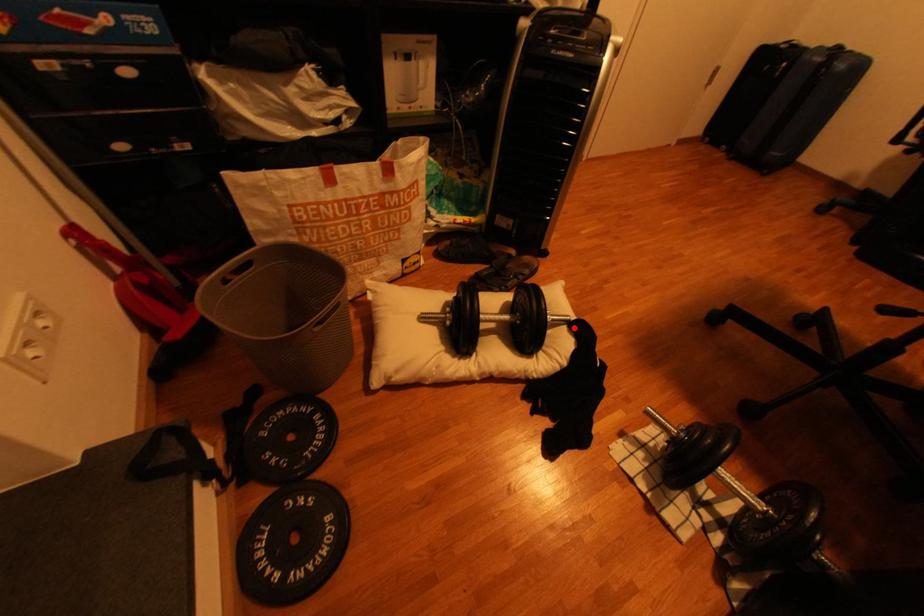
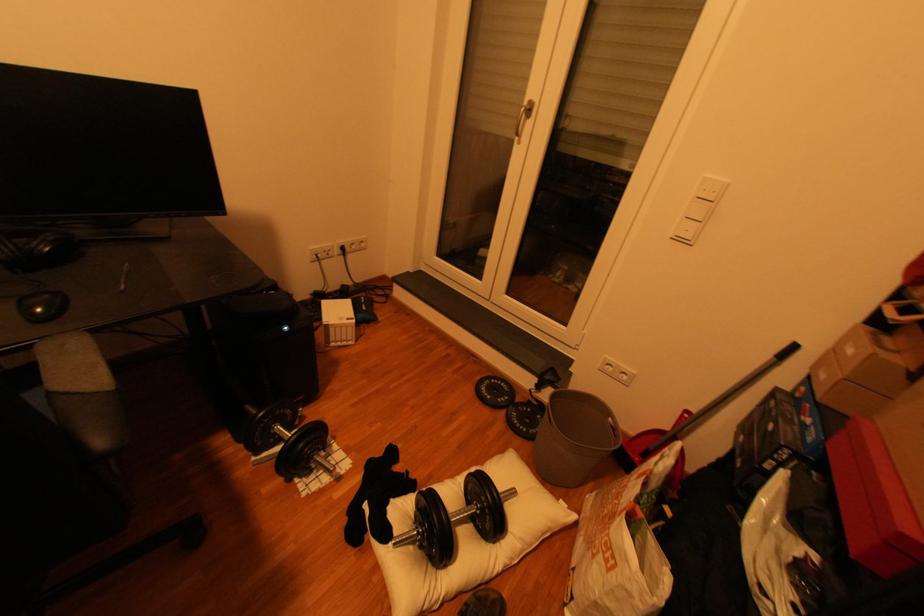
Where in the second image is the point corresponding to the highlighted location from the first image?

(406, 533)